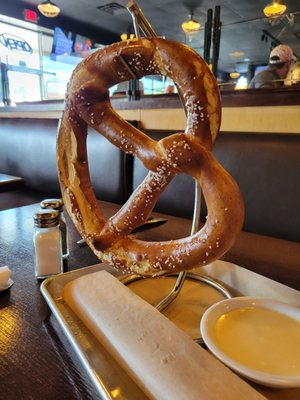
Identify the location of lights. (47, 10), (189, 28), (269, 8).